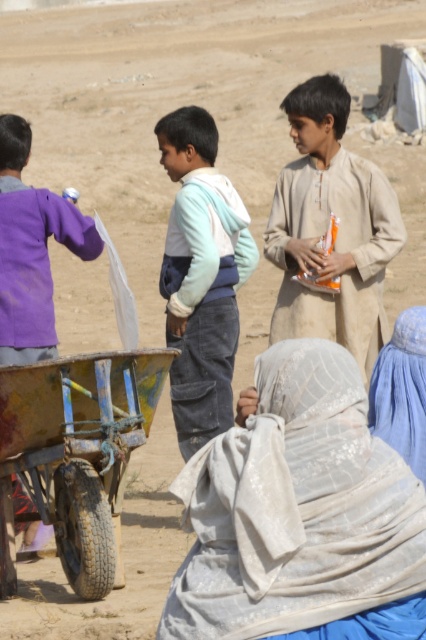
You are standing at the center of the image and see a point marked at coordinates (325, 228). Which object is this point located on?

The point at coordinates (325, 228) is located on the beige cotton shirt at center.

You are a photographer trying to capture a candid shot of the light blue denim pants at center and the purple cotton shirt at left. Since you want to focus on both subjects equally, which one should you adjust your camera angle to ensure both are in focus given their height difference?

The light blue denim pants at center is taller than the purple cotton shirt at left. To ensure both are in focus, adjust your camera angle to a midrange perspective that accommodates their height difference.

You are a photographer trying to capture a wide shot of the scene. You notice the light blue denim pants at center and the purple cotton shirt at left. Which clothing item would require you to zoom in more to capture details due to its smaller size?

The light blue denim pants at center has a lesser width compared to the purple cotton shirt at left, so you would need to zoom in more to capture details of the light blue denim pants at center because it is smaller in size.